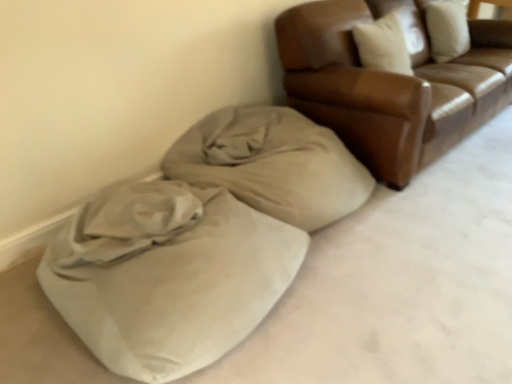
Question: Considering the relative positions of brown leather couch at upper right and suede-like beige bean bag at lower left in the image provided, is brown leather couch at upper right to the right of suede-like beige bean bag at lower left from the viewer's perspective?

Choices:
 (A) no
 (B) yes

Answer: (B)

Question: From the image's perspective, is brown leather couch at upper right on suede-like beige bean bag at lower left?

Choices:
 (A) yes
 (B) no

Answer: (A)

Question: Is the position of brown leather couch at upper right more distant than that of suede-like beige bean bag at lower left?

Choices:
 (A) no
 (B) yes

Answer: (B)

Question: Is brown leather couch at upper right outside suede-like beige bean bag at lower left?

Choices:
 (A) yes
 (B) no

Answer: (A)

Question: Is brown leather couch at upper right wider than suede-like beige bean bag at lower left?

Choices:
 (A) yes
 (B) no

Answer: (B)

Question: In the image, is suede-like beige bean bag at lower left on the left side or the right side of beige fabric blanket at lower left?

Choices:
 (A) left
 (B) right

Answer: (A)

Question: From their relative heights in the image, would you say suede-like beige bean bag at lower left is taller or shorter than beige fabric blanket at lower left?

Choices:
 (A) tall
 (B) short

Answer: (B)

Question: Looking at the image, does suede-like beige bean bag at lower left seem bigger or smaller compared to beige fabric blanket at lower left?

Choices:
 (A) small
 (B) big

Answer: (B)

Question: From the image's perspective, relative to beige fabric blanket at lower left, is suede-like beige bean bag at lower left above or below?

Choices:
 (A) above
 (B) below

Answer: (B)

Question: Is point (311, 182) positioned closer to the camera than point (53, 292)?

Choices:
 (A) farther
 (B) closer

Answer: (A)

Question: Considering the positions of beige fabric blanket at lower left and suede-like beige bean bag at lower left in the image, is beige fabric blanket at lower left bigger or smaller than suede-like beige bean bag at lower left?

Choices:
 (A) small
 (B) big

Answer: (A)

Question: Choose the correct answer: Is beige fabric blanket at lower left inside suede-like beige bean bag at lower left or outside it?

Choices:
 (A) inside
 (B) outside

Answer: (B)

Question: Considering the positions of beige fabric blanket at lower left and suede-like beige bean bag at lower left in the image, is beige fabric blanket at lower left taller or shorter than suede-like beige bean bag at lower left?

Choices:
 (A) tall
 (B) short

Answer: (A)

Question: Considering the positions of beige fabric blanket at lower left and brown leather couch at upper right in the image, is beige fabric blanket at lower left taller or shorter than brown leather couch at upper right?

Choices:
 (A) short
 (B) tall

Answer: (A)

Question: Would you say beige fabric blanket at lower left is to the left or to the right of brown leather couch at upper right in the picture?

Choices:
 (A) left
 (B) right

Answer: (A)